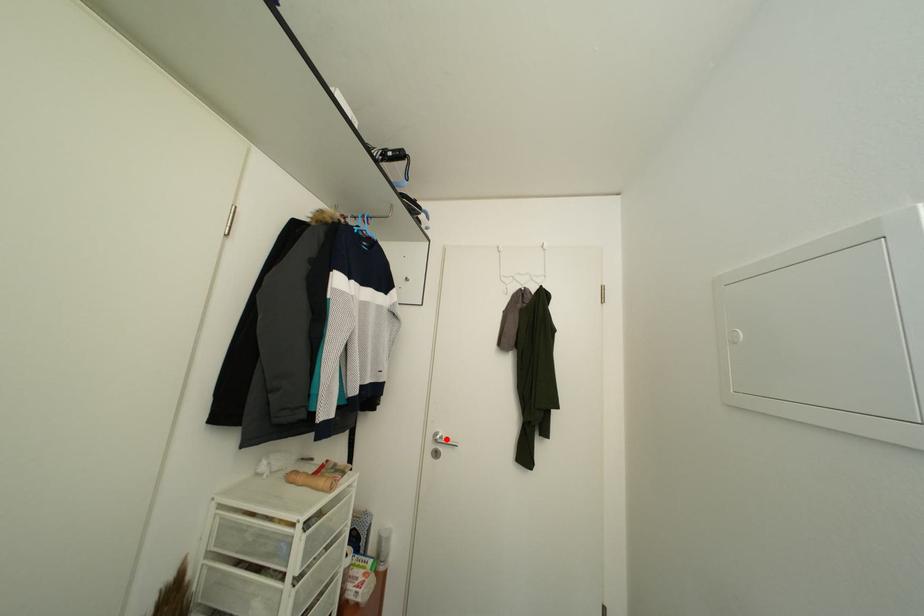
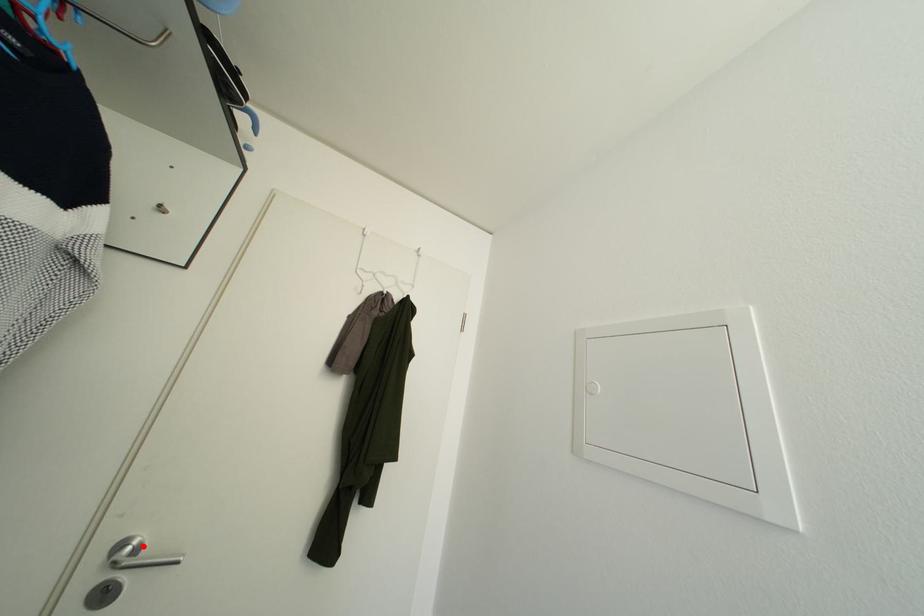
I am providing you with two images of the same scene from different viewpoints. A red point is marked on the first image and another point is marked on the second image. Does the point marked in image1 correspond to the same location as the one in image2?

Yes